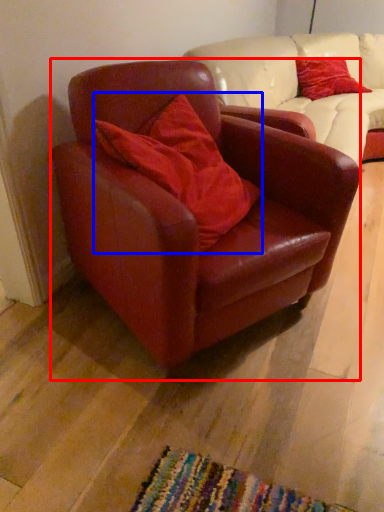
Question: Among these objects, which one is nearest to the camera, chair (highlighted by a red box) or pillow (highlighted by a blue box)?

Choices:
 (A) chair
 (B) pillow

Answer: (A)